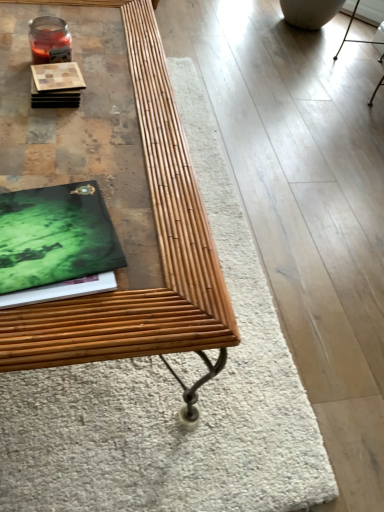
Where is `vacant area located to the right-hand side of wooden coaster at upper left`? The height and width of the screenshot is (512, 384). vacant area located to the right-hand side of wooden coaster at upper left is located at coordinates (131, 110).